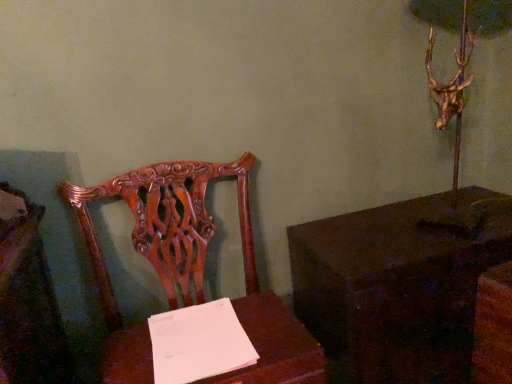
The height and width of the screenshot is (384, 512). What are the coordinates of `dark wood table at right, which is counted as the second table, starting from the left` in the screenshot? It's located at (399, 285).

In order to face wooden table at center, which is the first table from left to right, should I rotate leftwards or rightwards?

It's best to rotate left around 6.612 degrees.

The image size is (512, 384). What do you see at coordinates (275, 345) in the screenshot? I see `wooden table at center, which ranks as the second table in right-to-left order` at bounding box center [275, 345].

Find the location of a particular element. This screenshot has width=512, height=384. dark wood table at right, which is counted as the second table, starting from the left is located at coordinates (399, 285).

Is wooden table at center, which ranks as the second table in right-to-left order, aimed at dark wood table at right, which is counted as the second table, starting from the left?

No, wooden table at center, which ranks as the second table in right-to-left order, does not turn towards dark wood table at right, which is counted as the second table, starting from the left.

Which object is wider, wooden table at center, which is the first table from left to right, or dark wood table at right, which is counted as the second table, starting from the left?

With larger width is dark wood table at right, which is counted as the second table, starting from the left.

Between wooden table at center, which ranks as the second table in right-to-left order, and dark wood table at right, which is counted as the first table, starting from the right, which one has larger size?

With larger size is dark wood table at right, which is counted as the first table, starting from the right.

In the scene shown: Is polished wood chair at center at the left side of dark wood table at right, which is counted as the second table, starting from the left?

Indeed, polished wood chair at center is positioned on the left side of dark wood table at right, which is counted as the second table, starting from the left.

Measure the distance between polished wood chair at center and dark wood table at right, which is counted as the second table, starting from the left.

A distance of 13.37 inches exists between polished wood chair at center and dark wood table at right, which is counted as the second table, starting from the left.

In terms of size, does polished wood chair at center appear bigger or smaller than dark wood table at right, which is counted as the first table, starting from the right?

Clearly, polished wood chair at center is larger in size than dark wood table at right, which is counted as the first table, starting from the right.

Is polished wood chair at center shorter than dark wood table at right, which is counted as the second table, starting from the left?

In fact, polished wood chair at center may be taller than dark wood table at right, which is counted as the second table, starting from the left.

Consider the image. Is polished wood chair at center spatially inside wooden table at center, which is the first table from left to right, or outside of it?

polished wood chair at center is outside wooden table at center, which is the first table from left to right.

Who is smaller, polished wood chair at center or wooden table at center, which ranks as the second table in right-to-left order?

wooden table at center, which ranks as the second table in right-to-left order.

From the picture: How different are the orientations of polished wood chair at center and wooden table at center, which is the first table from left to right, in degrees?

The facing directions of polished wood chair at center and wooden table at center, which is the first table from left to right, are 0.522 degrees apart.

Between polished wood chair at center and wooden table at center, which is the first table from left to right, which one has less height?

wooden table at center, which is the first table from left to right, is shorter.

Considering the positions of objects dark wood table at right, which is counted as the second table, starting from the left, and polished wood chair at center in the image provided, who is behind, dark wood table at right, which is counted as the second table, starting from the left, or polished wood chair at center?

dark wood table at right, which is counted as the second table, starting from the left, is more distant.

Does dark wood table at right, which is counted as the first table, starting from the right, have a lesser width compared to polished wood chair at center?

Yes, dark wood table at right, which is counted as the first table, starting from the right, is thinner than polished wood chair at center.

Could polished wood chair at center be considered to be inside dark wood table at right, which is counted as the first table, starting from the right?

That's incorrect, polished wood chair at center is not inside dark wood table at right, which is counted as the first table, starting from the right.

Locate an element on the screen. The image size is (512, 384). the 2nd table counting from the right side of the polished wood chair at center is located at coordinates (399, 285).

Does dark wood table at right, which is counted as the second table, starting from the left, touch wooden table at center, which ranks as the second table in right-to-left order?

There is a gap between dark wood table at right, which is counted as the second table, starting from the left, and wooden table at center, which ranks as the second table in right-to-left order.

Does dark wood table at right, which is counted as the second table, starting from the left, have a lesser width compared to wooden table at center, which ranks as the second table in right-to-left order?

No.

Is dark wood table at right, which is counted as the second table, starting from the left, facing towards wooden table at center, which ranks as the second table in right-to-left order?

No, dark wood table at right, which is counted as the second table, starting from the left, is not turned towards wooden table at center, which ranks as the second table in right-to-left order.

Is dark wood table at right, which is counted as the first table, starting from the right, to the right of wooden table at center, which is the first table from left to right, from the viewer's perspective?

Indeed, dark wood table at right, which is counted as the first table, starting from the right, is positioned on the right side of wooden table at center, which is the first table from left to right.

Is wooden table at center, which is the first table from left to right, positioned far away from polished wood chair at center?

Actually, wooden table at center, which is the first table from left to right, and polished wood chair at center are a little close together.

Is point (130, 346) positioned behind point (297, 321)?

No, it is not.

Locate an element on the screen. The width and height of the screenshot is (512, 384). chair lying above the wooden table at center, which ranks as the second table in right-to-left order (from the image's perspective) is located at coordinates (192, 271).

You are a GUI agent. You are given a task and a screenshot of the screen. Output one action in this format:
    pyautogui.click(x=<x>, y=<y>)
    Task: Click on the table that is below the wooden table at center, which ranks as the second table in right-to-left order (from the image's perspective)
    Image resolution: width=512 pixels, height=384 pixels.
    Given the screenshot: What is the action you would take?
    pyautogui.click(x=399, y=285)

Image resolution: width=512 pixels, height=384 pixels. I want to click on chair above the dark wood table at right, which is counted as the first table, starting from the right (from a real-world perspective), so click(x=192, y=271).

Looking at the image, which one is located closer to dark wood table at right, which is counted as the first table, starting from the right, polished wood chair at center or wooden table at center, which ranks as the second table in right-to-left order?

wooden table at center, which ranks as the second table in right-to-left order, lies closer to dark wood table at right, which is counted as the first table, starting from the right, than the other object.

From the image, which object appears to be farther from wooden table at center, which is the first table from left to right, polished wood chair at center or dark wood table at right, which is counted as the second table, starting from the left?

Among the two, dark wood table at right, which is counted as the second table, starting from the left, is located further to wooden table at center, which is the first table from left to right.

Considering their positions, is dark wood table at right, which is counted as the first table, starting from the right, positioned closer to wooden table at center, which ranks as the second table in right-to-left order, than polished wood chair at center?

polished wood chair at center is positioned closer to the anchor wooden table at center, which ranks as the second table in right-to-left order.

Estimate the real-world distances between objects in this image. Which object is closer to polished wood chair at center, wooden table at center, which is the first table from left to right, or dark wood table at right, which is counted as the second table, starting from the left?

The object closer to polished wood chair at center is wooden table at center, which is the first table from left to right.

Looking at the image, which one is located further to polished wood chair at center, dark wood table at right, which is counted as the second table, starting from the left, or wooden table at center, which is the first table from left to right?

dark wood table at right, which is counted as the second table, starting from the left, is further to polished wood chair at center.

Estimate the real-world distances between objects in this image. Which object is closer to dark wood table at right, which is counted as the second table, starting from the left, wooden table at center, which ranks as the second table in right-to-left order, or polished wood chair at center?

wooden table at center, which ranks as the second table in right-to-left order, is closer to dark wood table at right, which is counted as the second table, starting from the left.

Locate an element on the screen. This screenshot has width=512, height=384. table situated between polished wood chair at center and dark wood table at right, which is counted as the second table, starting from the left, from left to right is located at coordinates (275, 345).